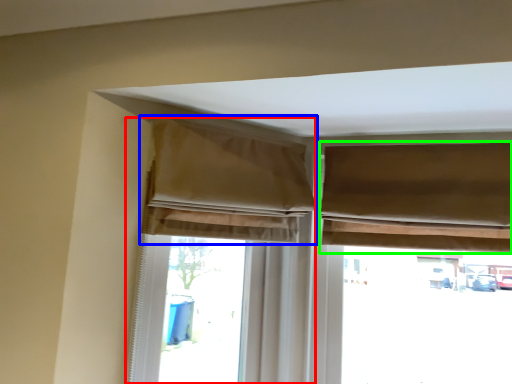
Question: Considering the real-world distances, which object is farthest from curtain (highlighted by a red box)? curtain (highlighted by a blue box) or curtain (highlighted by a green box)?

Choices:
 (A) curtain
 (B) curtain

Answer: (B)